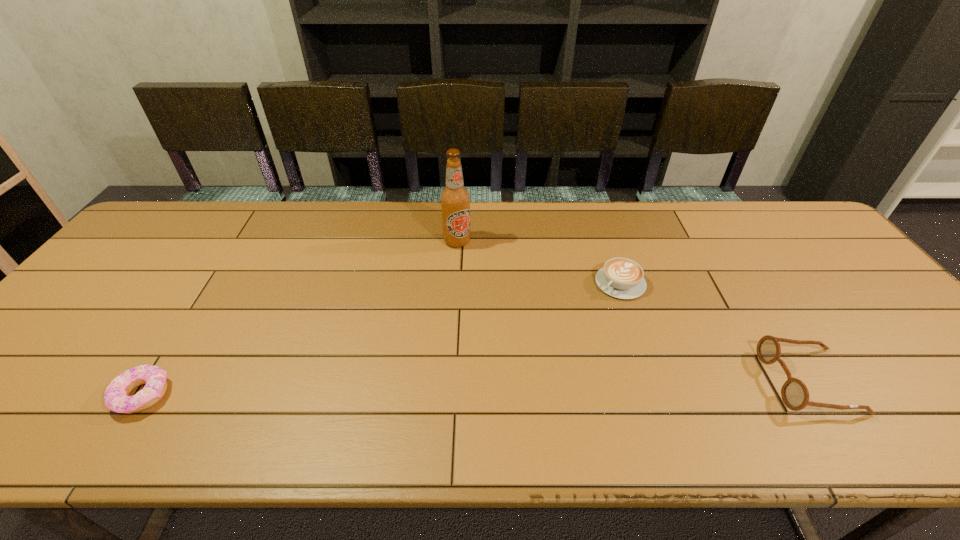
Where is `vacant space located on the front-facing side of the spectacles`? Image resolution: width=960 pixels, height=540 pixels. vacant space located on the front-facing side of the spectacles is located at coordinates (743, 381).

You are a GUI agent. You are given a task and a screenshot of the screen. Output one action in this format:
    pyautogui.click(x=<x>, y=<y>)
    Task: Click on the blank space located on the side of the second farthest object with the handle
    The image size is (960, 540).
    Given the screenshot: What is the action you would take?
    pyautogui.click(x=588, y=311)

I want to click on vacant space located on the side of the second farthest object with the handle, so click(x=587, y=313).

This screenshot has height=540, width=960. I want to click on free spot located on the side of the second farthest object with the handle, so click(x=560, y=336).

This screenshot has height=540, width=960. In order to click on blank space located 0.070m on the front label of the farthest object in this screenshot , I will do pyautogui.click(x=465, y=265).

Identify the location of free region located 0.360m on the front label of the farthest object. (490, 342).

Locate an element on the screen. vacant space located on the front label of the farthest object is located at coordinates tap(474, 294).

Image resolution: width=960 pixels, height=540 pixels. Identify the location of object at the far edge. (455, 199).

What are the coordinates of `doughnut present at the near edge` in the screenshot? It's located at (116, 396).

The image size is (960, 540). I want to click on spectacles that is at the near edge, so click(x=795, y=395).